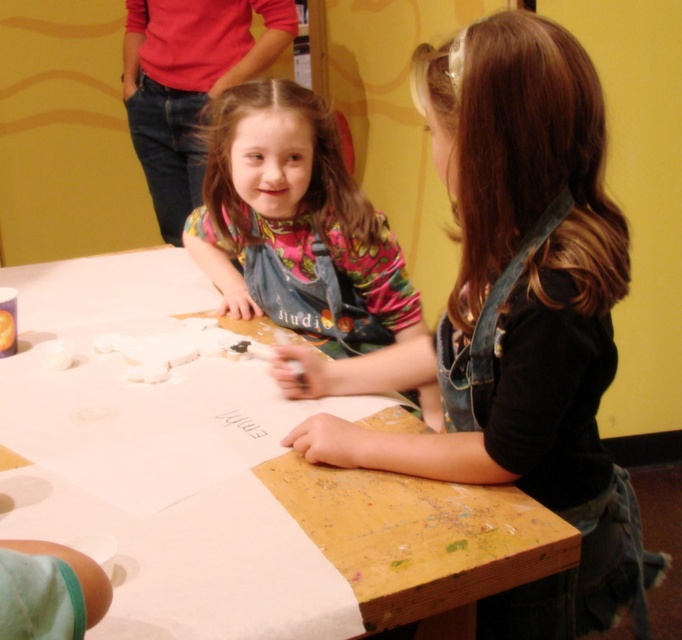
Question: Estimate the real-world distances between objects in this image. Which object is farther from the denim overalls at center?

Choices:
 (A) white paper at center
 (B) matte denim apron at center

Answer: (A)

Question: Which object appears farthest from the camera in this image?

Choices:
 (A) white paper at center
 (B) matte denim apron at center
 (C) denim overalls at center

Answer: (A)

Question: Considering the relative positions of denim overalls at center and matte denim apron at center in the image provided, where is denim overalls at center located with respect to matte denim apron at center?

Choices:
 (A) left
 (B) right

Answer: (B)

Question: From the image, what is the correct spatial relationship of denim overalls at center in relation to white paper at center?

Choices:
 (A) right
 (B) left

Answer: (A)

Question: Can you confirm if denim overalls at center is positioned below white paper at center?

Choices:
 (A) no
 (B) yes

Answer: (B)

Question: Which object is farther from the camera taking this photo?

Choices:
 (A) matte denim apron at center
 (B) denim overalls at center
 (C) white paper at center

Answer: (C)